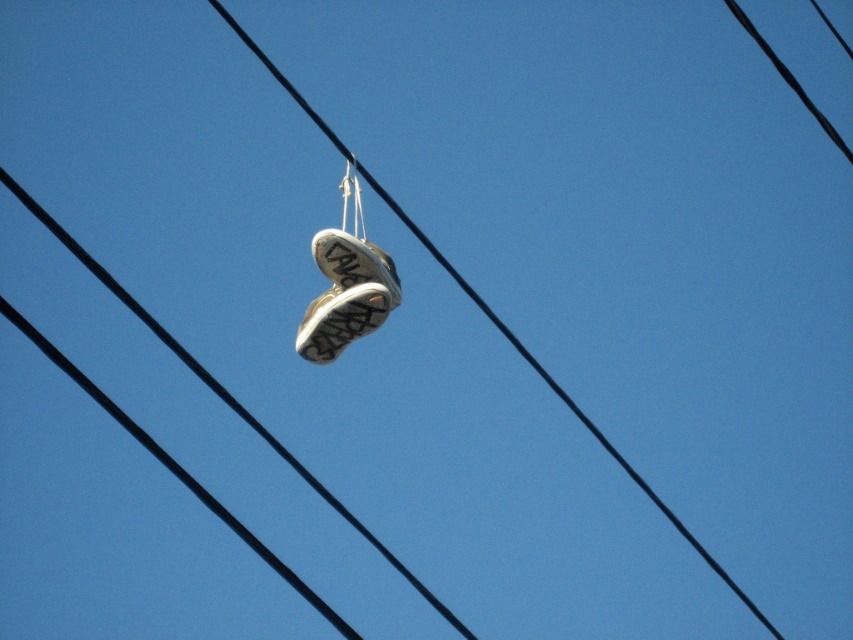
You are an observer looking at the image. Which object, the white leather sneakers at center or the black rubber shoe at center, is shorter in height?

The white leather sneakers at center has a lesser height compared to the black rubber shoe at center, so the white leather sneakers at center is shorter.

You are an observer looking at the image. You notice two shoes hanging from wires in the sky. Which shoe is positioned higher between the white leather sneakers at center and the white fabric shoe at center?

The white leather sneakers at center is positioned higher than the white fabric shoe at center.

From the picture: You are an observer looking at the image of two shoes hanging from wires. Which shoe is located to the left when looking at the white leather sneakers at center and the white fabric shoe at center?

The white fabric shoe at center is located to the left of the white leather sneakers at center.